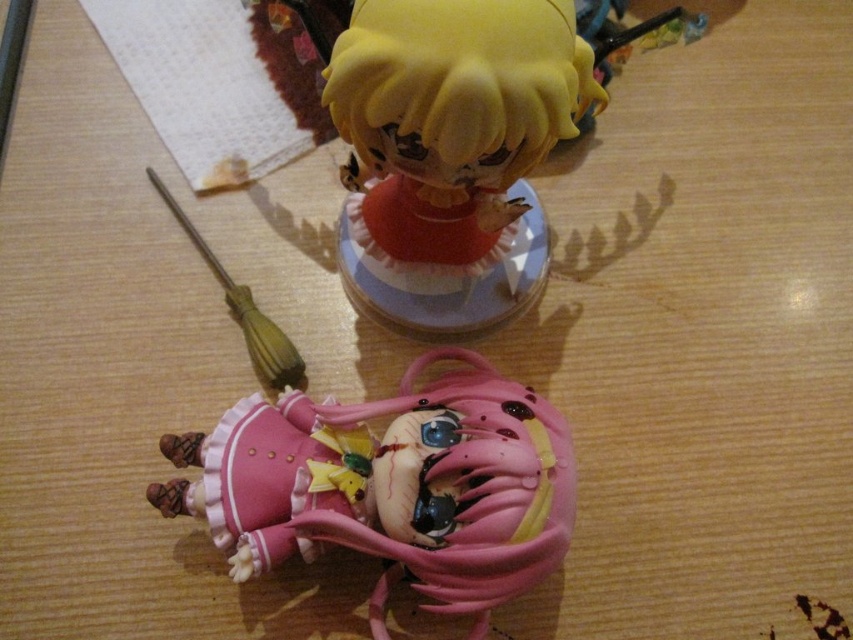
Question: Is pink matte doll at lower center thinner than yellow matte figurine at upper center?

Choices:
 (A) no
 (B) yes

Answer: (A)

Question: Among these points, which one is nearest to the camera?

Choices:
 (A) (537, 35)
 (B) (483, 426)

Answer: (A)

Question: Is pink matte doll at lower center thinner than yellow matte figurine at upper center?

Choices:
 (A) yes
 (B) no

Answer: (B)

Question: Which point is closer to the camera?

Choices:
 (A) yellow matte figurine at upper center
 (B) pink matte doll at lower center

Answer: (A)

Question: Does pink matte doll at lower center have a lesser width compared to yellow matte figurine at upper center?

Choices:
 (A) yes
 (B) no

Answer: (B)